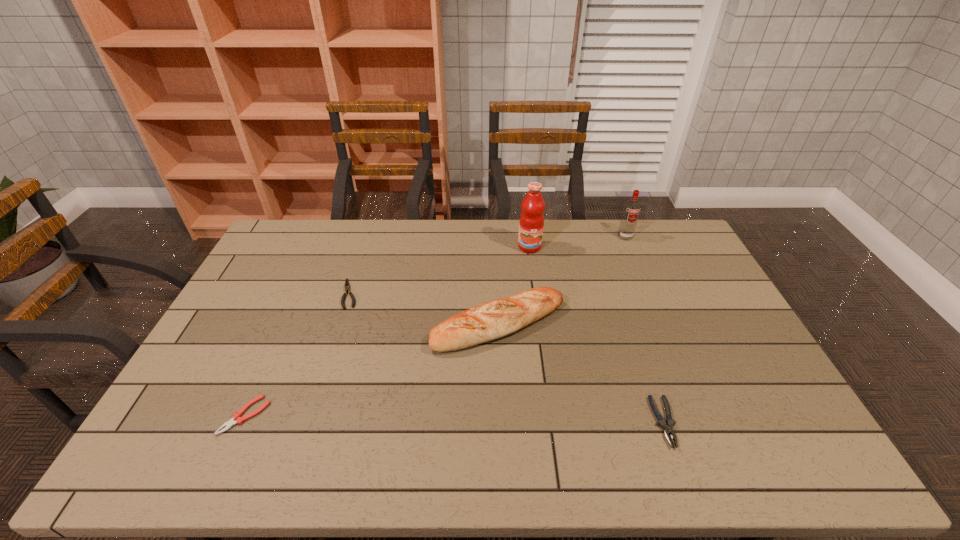
Where is `free point at the left edge`? The width and height of the screenshot is (960, 540). free point at the left edge is located at coordinates (294, 276).

In the image, there is a desktop. Identify the location of blank space at the right edge. (803, 436).

Locate an element on the screen. The image size is (960, 540). free space at the far left corner of the desktop is located at coordinates (283, 229).

The width and height of the screenshot is (960, 540). Identify the location of vacant space at the near left corner of the desktop. (172, 437).

This screenshot has height=540, width=960. I want to click on free space between the rightmost pliers and the tallest object, so click(597, 334).

Where is `unoccupied position between the leftmost object and the baguet`? The image size is (960, 540). unoccupied position between the leftmost object and the baguet is located at coordinates (372, 370).

Where is `free space between the rightmost pliers and the leftmost pliers`? free space between the rightmost pliers and the leftmost pliers is located at coordinates (455, 418).

The image size is (960, 540). What are the coordinates of `vacant space in between the rightmost pliers and the leftmost object` in the screenshot? It's located at (455, 418).

Locate an element on the screen. free space that is in between the rightmost pliers and the tallest object is located at coordinates pyautogui.click(x=597, y=334).

Where is `empty space that is in between the second pliers from right to left and the leftmost object`? This screenshot has width=960, height=540. empty space that is in between the second pliers from right to left and the leftmost object is located at coordinates (298, 355).